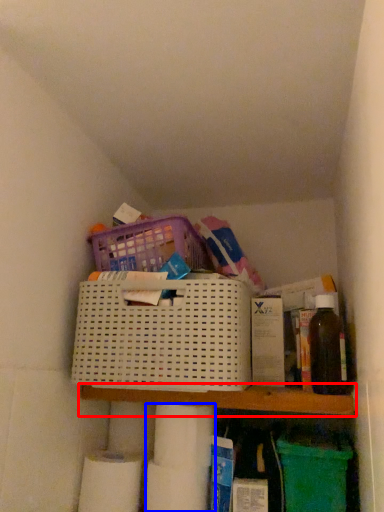
Question: Which object is closer to the camera taking this photo, shelf (highlighted by a red box) or toilet paper (highlighted by a blue box)?

Choices:
 (A) shelf
 (B) toilet paper

Answer: (A)